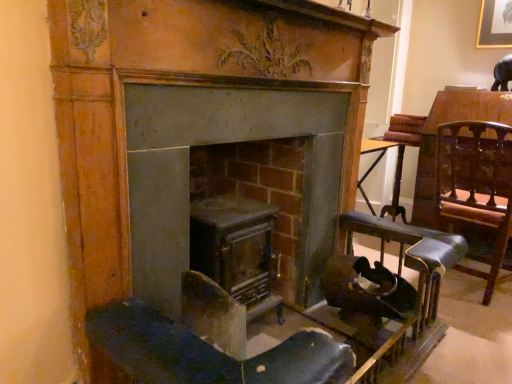
Question: From a real-world perspective, is leather seat at right under matte gray fireplace at center, the 1th fireplace when ordered from right to left?

Choices:
 (A) yes
 (B) no

Answer: (A)

Question: Does leather seat at right have a larger size compared to matte gray fireplace at center, which is the 2th fireplace in left-to-right order?

Choices:
 (A) no
 (B) yes

Answer: (B)

Question: Can you confirm if leather seat at right is thinner than matte gray fireplace at center, which is the 2th fireplace in left-to-right order?

Choices:
 (A) yes
 (B) no

Answer: (B)

Question: Considering the relative sizes of leather seat at right and matte gray fireplace at center, which is the 2th fireplace in left-to-right order, in the image provided, is leather seat at right wider than matte gray fireplace at center, which is the 2th fireplace in left-to-right order,?

Choices:
 (A) no
 (B) yes

Answer: (B)

Question: Is leather seat at right positioned with its back to matte gray fireplace at center, which is the 2th fireplace in left-to-right order?

Choices:
 (A) no
 (B) yes

Answer: (B)

Question: Does leather seat at right contain matte gray fireplace at center, which is the 2th fireplace in left-to-right order?

Choices:
 (A) yes
 (B) no

Answer: (B)

Question: Is matte gray fireplace at center, the 1th fireplace when ordered from right to left, aimed at leather seat at right?

Choices:
 (A) yes
 (B) no

Answer: (B)

Question: Is matte gray fireplace at center, which is the 2th fireplace in left-to-right order, wider than leather seat at right?

Choices:
 (A) yes
 (B) no

Answer: (B)

Question: From the image's perspective, does matte gray fireplace at center, the 1th fireplace when ordered from right to left, appear lower than leather seat at right?

Choices:
 (A) yes
 (B) no

Answer: (B)

Question: Is matte gray fireplace at center, the 1th fireplace when ordered from right to left, outside of leather seat at right?

Choices:
 (A) yes
 (B) no

Answer: (A)

Question: Can you confirm if matte gray fireplace at center, the 1th fireplace when ordered from right to left, is bigger than leather seat at right?

Choices:
 (A) no
 (B) yes

Answer: (A)

Question: Can you see matte gray fireplace at center, the 1th fireplace when ordered from right to left, touching leather seat at right?

Choices:
 (A) yes
 (B) no

Answer: (B)

Question: From the image's perspective, is matte gray fireplace at center, which is the 2th fireplace in left-to-right order, below metallic gray stove at center, which ranks as the first fireplace in left-to-right order?

Choices:
 (A) no
 (B) yes

Answer: (A)